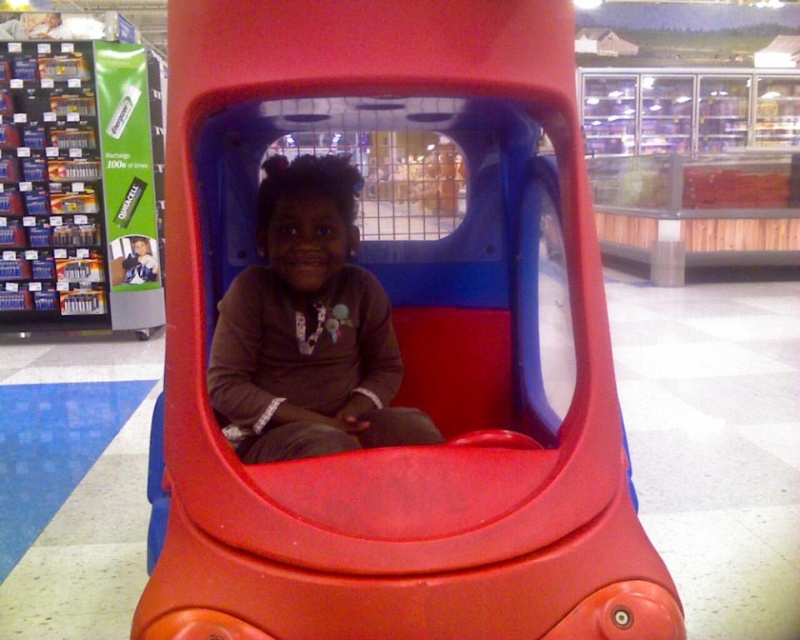
Is matte plastic toy car at center above matte brown shirt at center?

Yes, matte plastic toy car at center is above matte brown shirt at center.

Is matte plastic toy car at center positioned before matte brown shirt at center?

Yes.

Locate an element on the screen. The image size is (800, 640). matte plastic toy car at center is located at coordinates (400, 346).